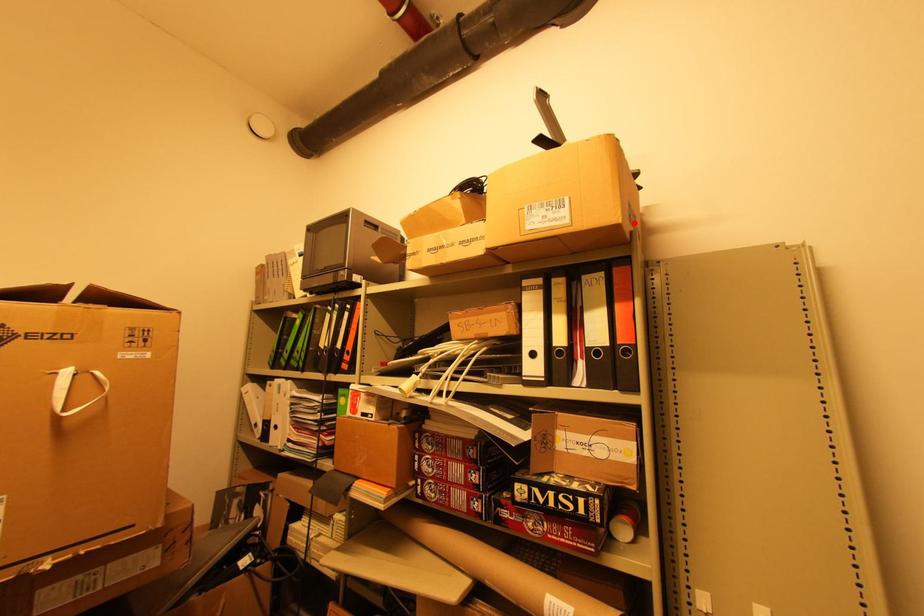
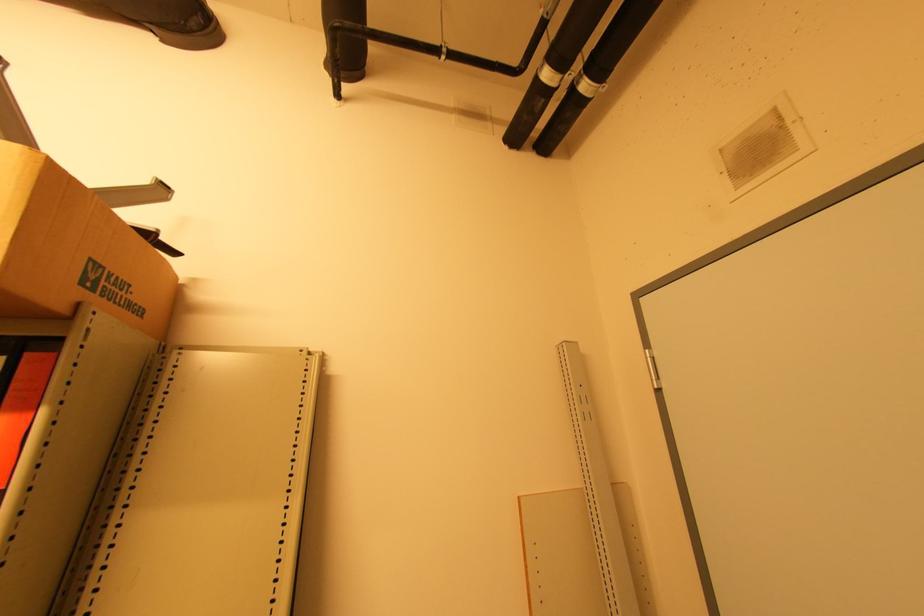
Find the pixel in the second image that matches the highlighted location in the first image.

(95, 290)